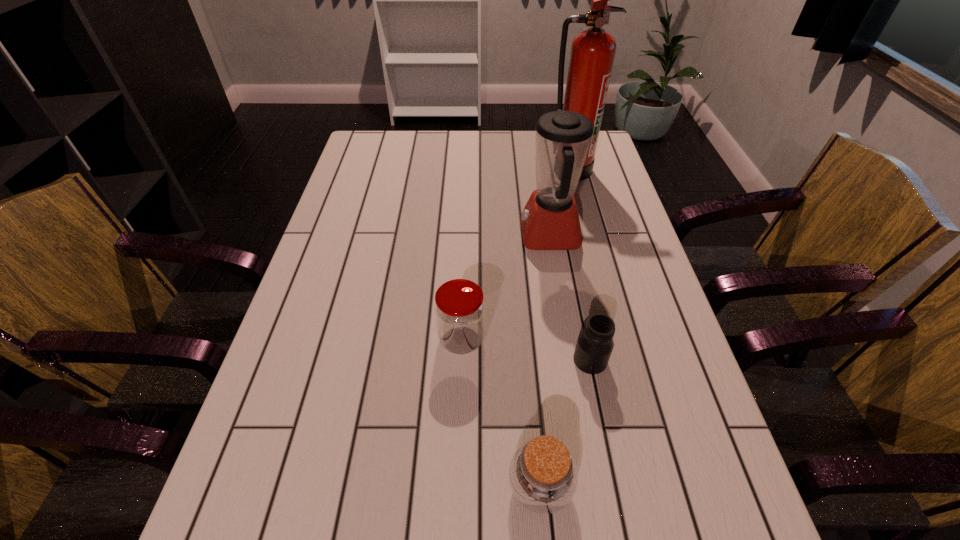
In the image, there is a desktop. What are the coordinates of `free space at the far edge` in the screenshot? It's located at (476, 139).

The image size is (960, 540). Identify the location of vacant space at the left edge of the desktop. (357, 219).

I want to click on free location at the right edge of the desktop, so click(583, 196).

Identify the location of free location at the far left corner. (407, 131).

You are a GUI agent. You are given a task and a screenshot of the screen. Output one action in this format:
    pyautogui.click(x=<x>, y=<y>)
    Task: Click on the free area in between the second farthest object and the rightmost jar
    The width and height of the screenshot is (960, 540).
    Given the screenshot: What is the action you would take?
    pyautogui.click(x=569, y=298)

Where is `vacant space that's between the leftmost jar and the tallest object`? The image size is (960, 540). vacant space that's between the leftmost jar and the tallest object is located at coordinates (516, 255).

This screenshot has height=540, width=960. I want to click on empty space between the nearest object and the rightmost jar, so click(565, 423).

Image resolution: width=960 pixels, height=540 pixels. What are the coordinates of `free space between the blender and the leftmost jar` in the screenshot? It's located at click(x=505, y=288).

Locate an element on the screen. The width and height of the screenshot is (960, 540). vacant point located between the leftmost object and the rightmost jar is located at coordinates (526, 350).

Identify the location of vacant area that lies between the second farthest object and the rightmost jar. (569, 298).